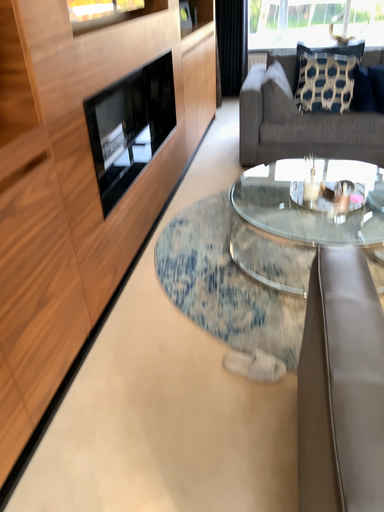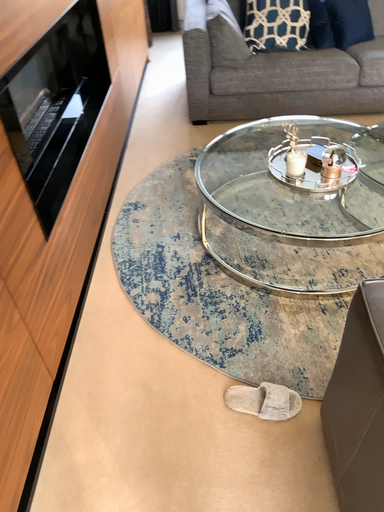
Question: Which way did the camera rotate in the video?

Choices:
 (A) rotated left
 (B) rotated right

Answer: (B)